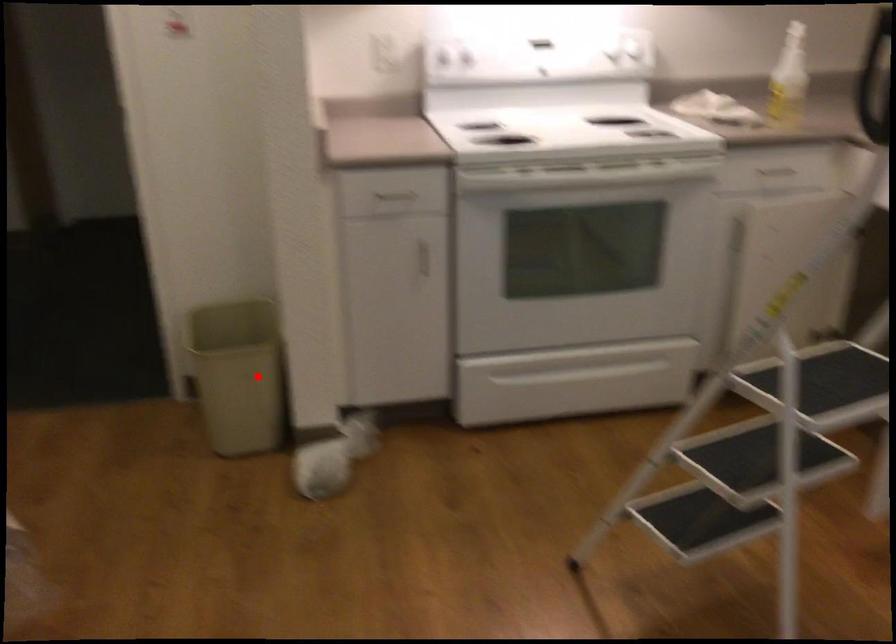
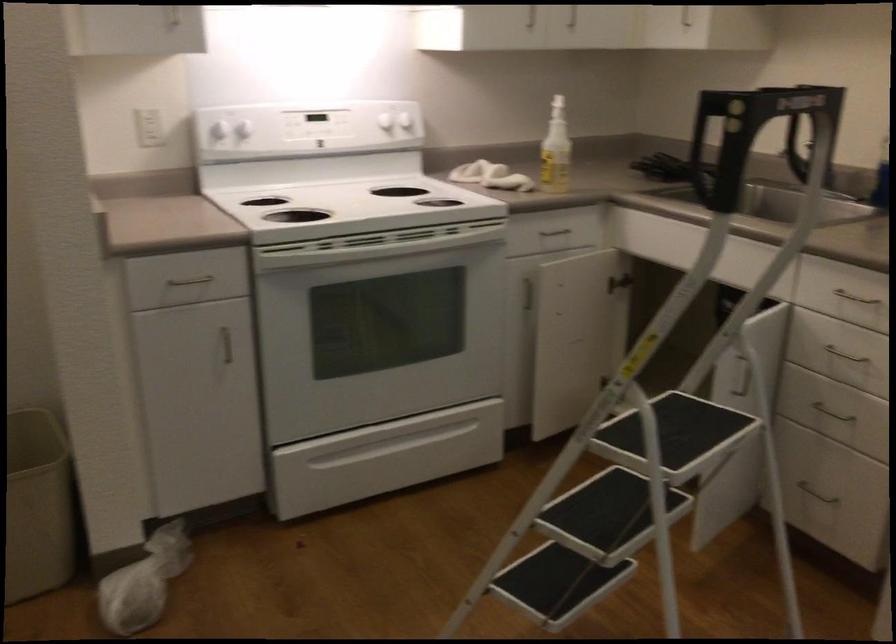
Find the pixel in the second image that matches the highlighted location in the first image.

(38, 506)